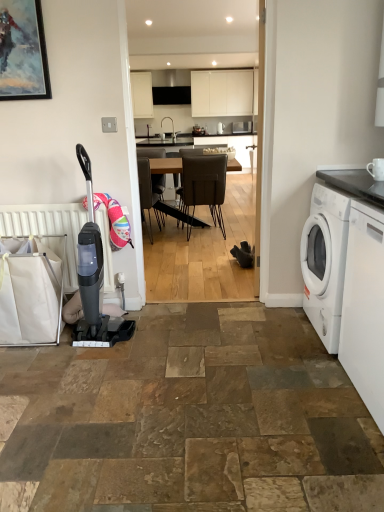
Measure the distance between point (71, 279) and camera.

The depth of point (71, 279) is 8.67 feet.

Where is `white ceramic mug at upper right`? This screenshot has width=384, height=512. white ceramic mug at upper right is located at coordinates (376, 169).

I want to click on white matte washing machine at right, the 1th washing machine viewed from the back, so click(x=325, y=262).

Describe the element at coordinates (142, 94) in the screenshot. I see `white matte cabinet at upper center, the 2th cabinetry from the right` at that location.

The height and width of the screenshot is (512, 384). What are the coordinates of `white matte radiator at left` in the screenshot? It's located at (48, 229).

Is white glossy washing machine at right, the first washing machine viewed from the front, smaller than black granite countertop at right?

Incorrect, white glossy washing machine at right, the first washing machine viewed from the front, is not smaller in size than black granite countertop at right.

Is white glossy washing machine at right, the first washing machine viewed from the front, closer to the viewer compared to black granite countertop at right?

Yes, white glossy washing machine at right, the first washing machine viewed from the front, is closer to the viewer.

What's the angular difference between white glossy washing machine at right, the first washing machine viewed from the front, and black granite countertop at right's facing directions?

The angle between the facing direction of white glossy washing machine at right, the first washing machine viewed from the front, and the facing direction of black granite countertop at right is 0.000357 degrees.

Is white glossy washing machine at right, which appears as the 2th washing machine when viewed from the back, inside the boundaries of black granite countertop at right, or outside?

white glossy washing machine at right, which appears as the 2th washing machine when viewed from the back, exists outside the volume of black granite countertop at right.

From the image's perspective, which is below, metallic painting at upper left or white matte washing machine at right, the 2th washing machine in the front-to-back sequence?

white matte washing machine at right, the 2th washing machine in the front-to-back sequence, is shown below in the image.

Which is in front, metallic painting at upper left or white matte washing machine at right, the 1th washing machine viewed from the back?

white matte washing machine at right, the 1th washing machine viewed from the back, is closer to the camera.

Could you tell me if metallic painting at upper left is turned towards white matte washing machine at right, the 2th washing machine in the front-to-back sequence?

No.

From their relative heights in the image, would you say metallic painting at upper left is taller or shorter than white matte washing machine at right, the 2th washing machine in the front-to-back sequence?

Clearly, metallic painting at upper left is shorter compared to white matte washing machine at right, the 2th washing machine in the front-to-back sequence.

Can you confirm if black matte exhaust hood at upper center is thinner than white matte radiator at left?

In fact, black matte exhaust hood at upper center might be wider than white matte radiator at left.

Measure the distance from black matte exhaust hood at upper center to white matte radiator at left.

black matte exhaust hood at upper center and white matte radiator at left are 5.40 meters apart.

From the image's perspective, which one is positioned lower, black matte exhaust hood at upper center or white matte radiator at left?

white matte radiator at left appears lower in the image.

Between black matte exhaust hood at upper center and white matte radiator at left, which one has more height?

Standing taller between the two is black matte exhaust hood at upper center.

Between brown leather chair at center and wooden table at center, which one has larger size?

wooden table at center.

In the scene shown: How distant is brown leather chair at center from wooden table at center?

1.36 meters.

How many degrees apart are the facing directions of brown leather chair at center and wooden table at center?

brown leather chair at center and wooden table at center are facing 0.000516 degrees away from each other.

Does brown leather chair at center contain wooden table at center?

That's incorrect, wooden table at center is not inside brown leather chair at center.

Which of these two, white ceramic mug at upper right or white glossy washing machine at right, which appears as the 2th washing machine when viewed from the back, stands shorter?

With less height is white ceramic mug at upper right.

From the image's perspective, which one is positioned lower, white ceramic mug at upper right or white glossy washing machine at right, which appears as the 2th washing machine when viewed from the back?

From the image's view, white glossy washing machine at right, which appears as the 2th washing machine when viewed from the back, is below.

Between point (382, 178) and point (350, 216), which one is positioned in front?

The point (382, 178) is closer.

Between white ceramic mug at upper right and white glossy washing machine at right, the first washing machine viewed from the front, which one appears on the left side from the viewer's perspective?

Positioned to the left is white glossy washing machine at right, the first washing machine viewed from the front.

Who is more distant, white ceramic mug at upper right or white matte cabinet at upper center, placed as the 1th cabinetry when sorted from left to right?

white matte cabinet at upper center, placed as the 1th cabinetry when sorted from left to right, is more distant.

Would you consider white ceramic mug at upper right to be distant from white matte cabinet at upper center, placed as the 1th cabinetry when sorted from left to right?

white ceramic mug at upper right is positioned a significant distance from white matte cabinet at upper center, placed as the 1th cabinetry when sorted from left to right.

Is white ceramic mug at upper right taller than white matte cabinet at upper center, the 2th cabinetry from the right?

No, white ceramic mug at upper right is not taller than white matte cabinet at upper center, the 2th cabinetry from the right.

Which object is closer to the camera, white glossy washing machine at right, which appears as the 2th washing machine when viewed from the back, or white matte cabinet at upper center, acting as the 1th cabinetry starting from the right?

A: white glossy washing machine at right, which appears as the 2th washing machine when viewed from the back, is in front.

Measure the distance between white glossy washing machine at right, which appears as the 2th washing machine when viewed from the back, and white matte cabinet at upper center, the 2th cabinetry positioned from the left.

white glossy washing machine at right, which appears as the 2th washing machine when viewed from the back, and white matte cabinet at upper center, the 2th cabinetry positioned from the left, are 19.32 feet apart from each other.

Is white glossy washing machine at right, which appears as the 2th washing machine when viewed from the back, directly adjacent to white matte cabinet at upper center, the 2th cabinetry positioned from the left?

white glossy washing machine at right, which appears as the 2th washing machine when viewed from the back, and white matte cabinet at upper center, the 2th cabinetry positioned from the left, are clearly separated.

Locate an element on the screen. The height and width of the screenshot is (512, 384). the 1st washing machine counting from the right side of the white matte cabinet at upper center, the 2th cabinetry positioned from the left is located at coordinates (364, 307).

Image resolution: width=384 pixels, height=512 pixels. I want to click on countertop that is above the white glossy washing machine at right, the first washing machine viewed from the front (from a real-world perspective), so click(x=355, y=184).

I want to click on the 1st washing machine below the metallic painting at upper left (from the image's perspective), so click(x=325, y=262).

Looking at the image, which one is located closer to white matte radiator at left, white ceramic mug at upper right or metallic painting at upper left?

metallic painting at upper left.

Considering their positions, is white matte cabinet at upper center, the 2th cabinetry from the right, positioned closer to white glossy washing machine at right, the first washing machine viewed from the front, than black granite countertop at right?

The object closer to white glossy washing machine at right, the first washing machine viewed from the front, is black granite countertop at right.

From the image, which object appears to be nearer to black matte exhaust hood at upper center, white matte cabinet at upper center, placed as the 1th cabinetry when sorted from left to right, or white matte cabinet at upper center, acting as the 1th cabinetry starting from the right?

white matte cabinet at upper center, placed as the 1th cabinetry when sorted from left to right, is closer to black matte exhaust hood at upper center.

Estimate the real-world distances between objects in this image. Which object is further from white matte cabinet at upper center, placed as the 1th cabinetry when sorted from left to right, black granite countertop at right or black matte exhaust hood at upper center?

Among the two, black granite countertop at right is located further to white matte cabinet at upper center, placed as the 1th cabinetry when sorted from left to right.

Which object lies further to the anchor point white matte cabinet at upper center, the 2th cabinetry positioned from the left, metallic painting at upper left or white glossy washing machine at right, the first washing machine viewed from the front?

Based on the image, white glossy washing machine at right, the first washing machine viewed from the front, appears to be further to white matte cabinet at upper center, the 2th cabinetry positioned from the left.

From the image, which object appears to be farther from white matte cabinet at upper center, acting as the 1th cabinetry starting from the right, white matte washing machine at right, the 2th washing machine in the front-to-back sequence, or white glossy washing machine at right, the first washing machine viewed from the front?

white glossy washing machine at right, the first washing machine viewed from the front, lies further to white matte cabinet at upper center, acting as the 1th cabinetry starting from the right, than the other object.

Which object lies further to the anchor point white ceramic mug at upper right, white matte cabinet at upper center, placed as the 1th cabinetry when sorted from left to right, or white matte radiator at left?

white matte cabinet at upper center, placed as the 1th cabinetry when sorted from left to right, is positioned further to the anchor white ceramic mug at upper right.

From the image, which object appears to be nearer to white matte radiator at left, brown leather chair at center or white matte cabinet at upper center, placed as the 1th cabinetry when sorted from left to right?

brown leather chair at center is closer to white matte radiator at left.

In order to click on countertop between white glossy washing machine at right, which appears as the 2th washing machine when viewed from the back, and white matte cabinet at upper center, the 2th cabinetry positioned from the left, in the front-back direction in this screenshot , I will do `click(355, 184)`.

At what (x,y) coordinates should I click in order to perform the action: click on chair between black granite countertop at right and white matte cabinet at upper center, placed as the 1th cabinetry when sorted from left to right, in the front-back direction. Please return your answer as a coordinate pair (x, y). Looking at the image, I should click on (204, 185).

Where is `picture frame positioned between white matte washing machine at right, the 1th washing machine viewed from the back, and white matte cabinet at upper center, placed as the 1th cabinetry when sorted from left to right, from near to far`? picture frame positioned between white matte washing machine at right, the 1th washing machine viewed from the back, and white matte cabinet at upper center, placed as the 1th cabinetry when sorted from left to right, from near to far is located at coordinates (23, 51).

Locate an element on the screen. exhaust hood between brown leather chair at center and white matte cabinet at upper center, the 2th cabinetry positioned from the left, in the front-back direction is located at coordinates (171, 87).